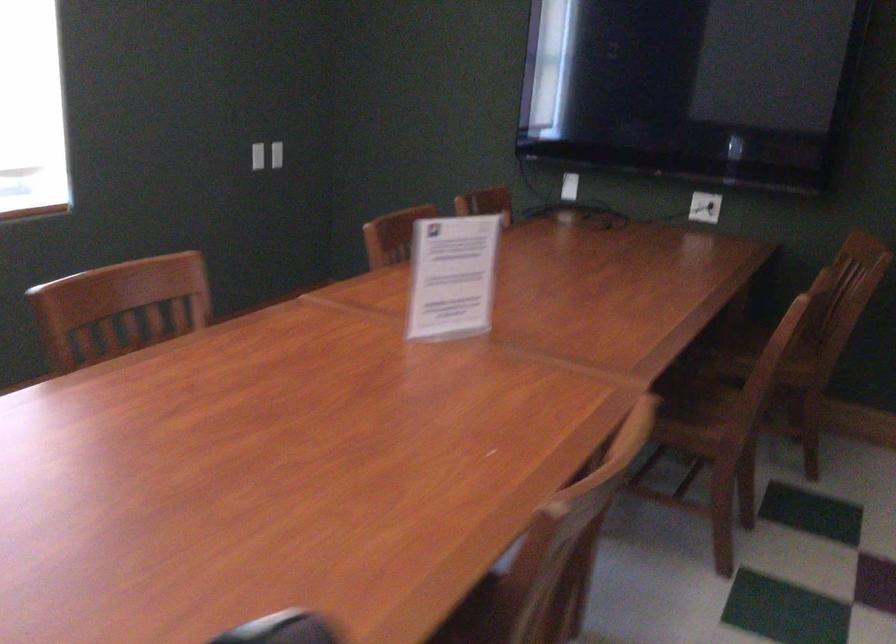
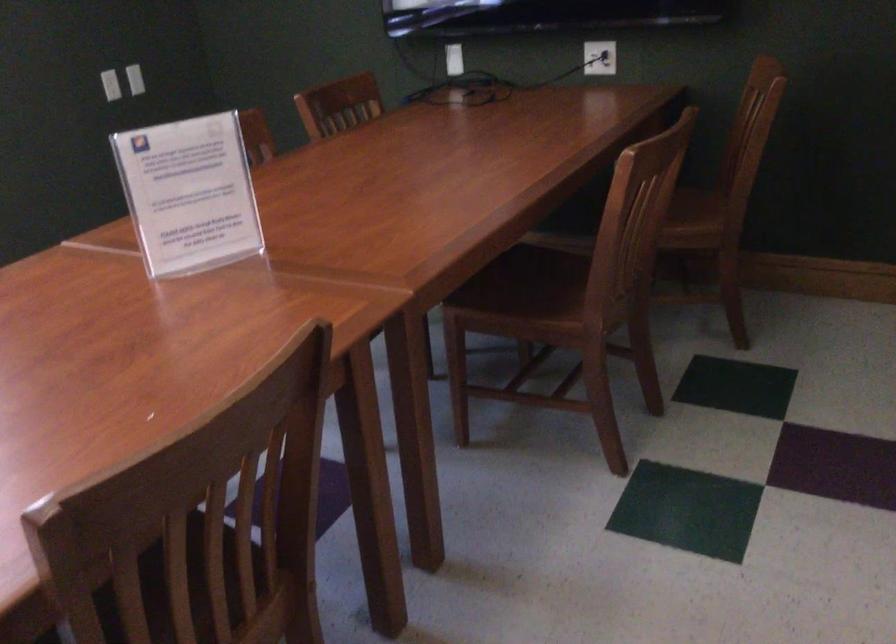
In the second image, find the point that corresponds to point (667, 400) in the first image.

(530, 292)